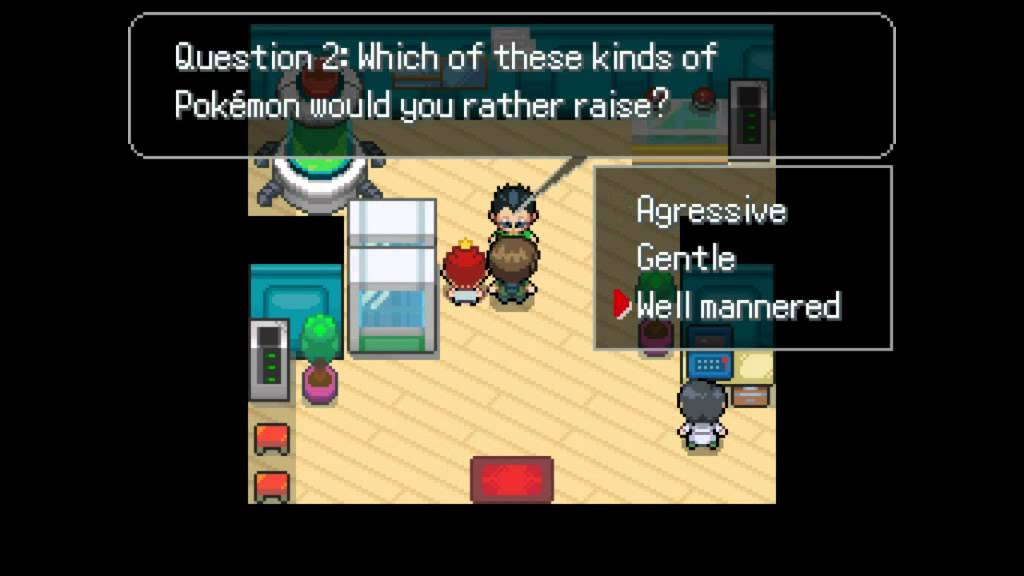
The height and width of the screenshot is (576, 1024). What are the coordinates of `desk` in the screenshot? It's located at (757, 385).